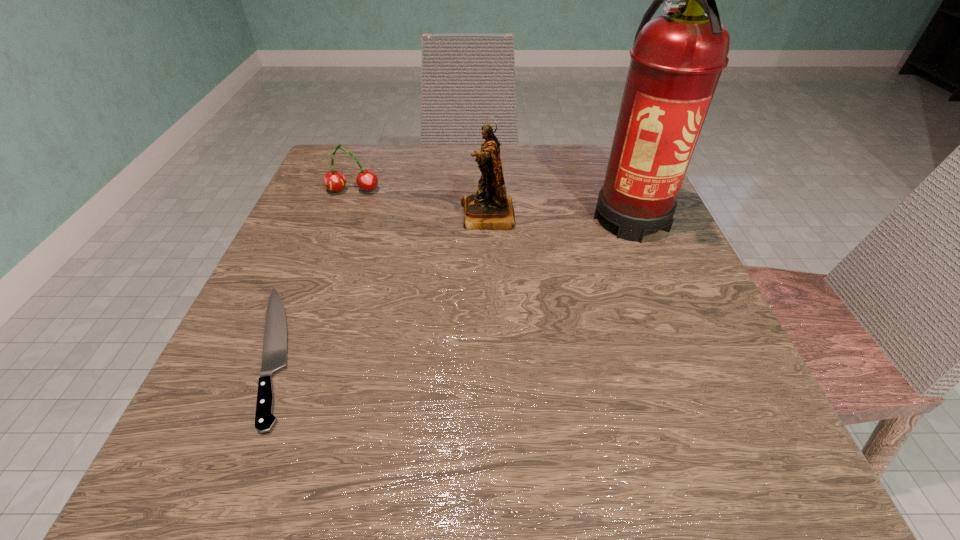
Locate an element on the screen. object located in the far left corner section of the desktop is located at coordinates (367, 180).

Identify the location of object that is at the near left corner. (274, 356).

The height and width of the screenshot is (540, 960). I want to click on object that is positioned at the far right corner, so point(677,58).

Image resolution: width=960 pixels, height=540 pixels. I want to click on free space at the far edge, so click(x=548, y=182).

In the image, there is a desktop. Identify the location of vacant space at the near edge. The width and height of the screenshot is (960, 540). (457, 438).

The image size is (960, 540). I want to click on vacant region at the left edge, so click(x=328, y=209).

In the image, there is a desktop. At what (x,y) coordinates should I click in order to perform the action: click on vacant region at the right edge. Please return your answer as a coordinate pair (x, y). Looking at the image, I should click on (672, 233).

Where is `vacant space at the far left corner of the desktop`? The width and height of the screenshot is (960, 540). vacant space at the far left corner of the desktop is located at coordinates (325, 158).

The width and height of the screenshot is (960, 540). I want to click on vacant space at the near left corner of the desktop, so click(x=211, y=490).

I want to click on vacant space at the far right corner, so click(589, 180).